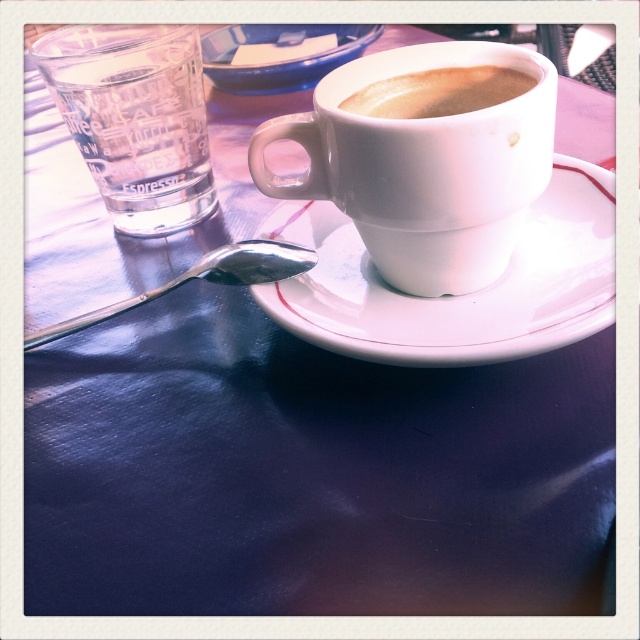
Question: Does white matte cup at center appear under transparent glass at left?

Choices:
 (A) no
 (B) yes

Answer: (B)

Question: Which point appears farthest from the camera in this image?

Choices:
 (A) (548, 337)
 (B) (376, 102)
 (C) (419, 170)
 (D) (189, 224)

Answer: (D)

Question: Is white matte cup at center bigger than transparent glass at left?

Choices:
 (A) yes
 (B) no

Answer: (A)

Question: Is the position of white matte cup at center less distant than that of transparent glass at left?

Choices:
 (A) no
 (B) yes

Answer: (B)

Question: Among these points, which one is nearest to the camera?

Choices:
 (A) (513, 307)
 (B) (486, 179)

Answer: (B)

Question: Which point is farther to the camera?

Choices:
 (A) (412, 301)
 (B) (356, 192)
 (C) (150, 88)

Answer: (C)